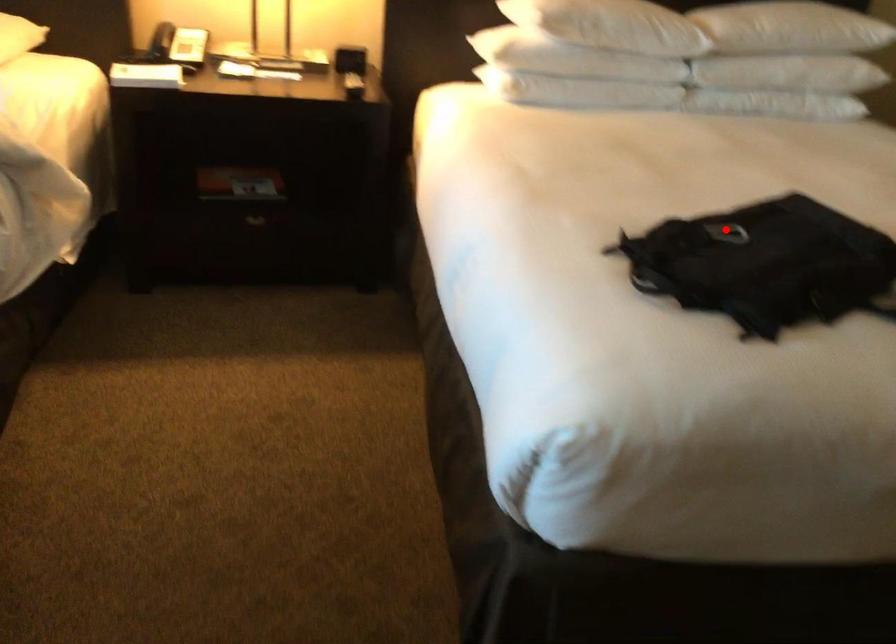
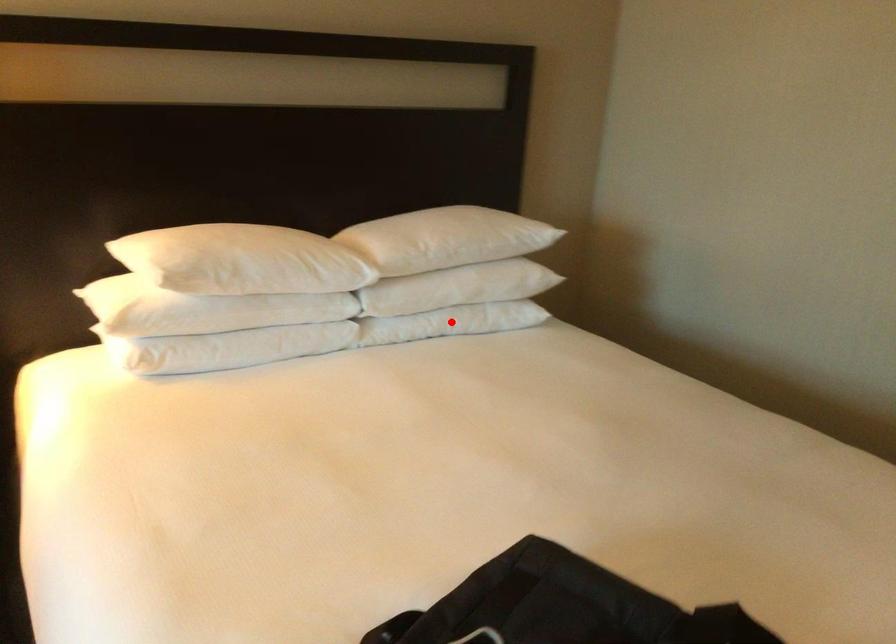
I am providing you with two images of the same scene from different viewpoints. A red point is marked on the first image and another point is marked on the second image. Are the points marked in image1 and image2 representing the same 3D position?

No